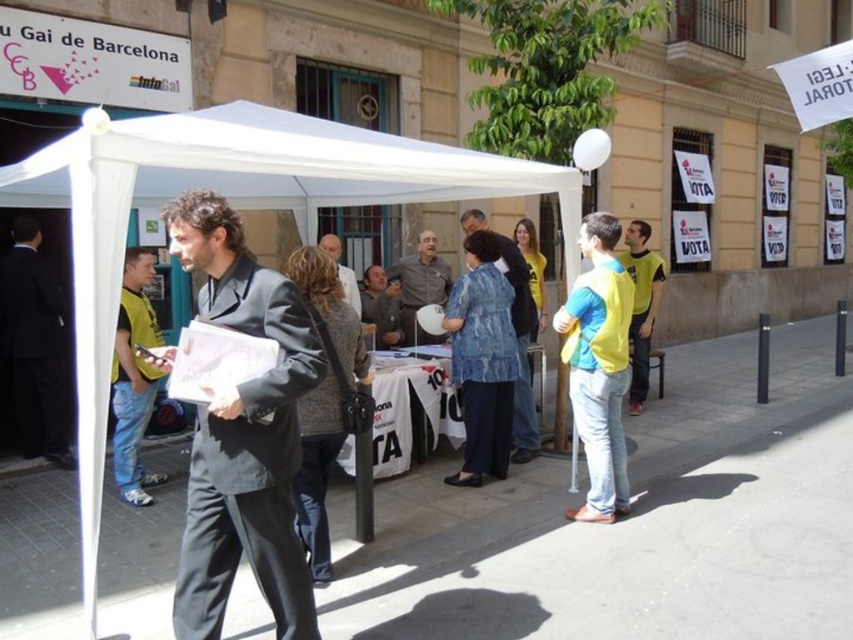
Question: Which of the following is the closest to the observer?

Choices:
 (A) dark gray shirt at center
 (B) white fabric canopy at center

Answer: (B)

Question: Observing the image, what is the correct spatial positioning of yellow fabric vest at right in reference to dark gray shirt at center?

Choices:
 (A) right
 (B) left

Answer: (A)

Question: Based on their relative distances, which object is nearer to the dark gray wool suit at center?

Choices:
 (A) yellow fabric vest at right
 (B) dark gray suit at left

Answer: (A)

Question: Is white fabric canopy at center bigger than matte black jacket at left?

Choices:
 (A) yes
 (B) no

Answer: (A)

Question: Does white fabric canopy at center have a smaller size compared to yellow matte shirt at center?

Choices:
 (A) yes
 (B) no

Answer: (B)

Question: Which object is positioned closest to the yellow fabric vest at right?

Choices:
 (A) dark gray shirt at center
 (B) dark gray wool suit at center
 (C) yellow matte shirt at center

Answer: (B)